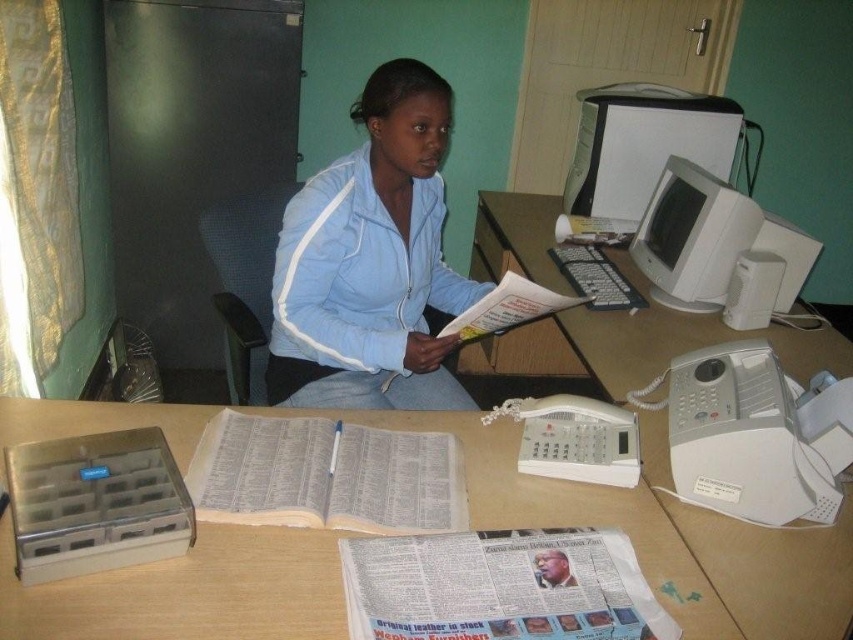
Can you confirm if white paper newspaper at center is positioned above matte gray monitor at upper right?

No, white paper newspaper at center is not above matte gray monitor at upper right.

Image resolution: width=853 pixels, height=640 pixels. Describe the element at coordinates (500, 586) in the screenshot. I see `white paper newspaper at center` at that location.

Which is in front, point (440, 556) or point (706, 216)?

Point (440, 556) is in front.

You are a GUI agent. You are given a task and a screenshot of the screen. Output one action in this format:
    pyautogui.click(x=<x>, y=<y>)
    Task: Click on the white paper newspaper at center
    
    Given the screenshot: What is the action you would take?
    pyautogui.click(x=500, y=586)

Does point (251, 538) come behind point (413, 516)?

No.

Does wooden table at center have a lesser height compared to white paper book at center?

No.

Identify the location of wooden table at center. The width and height of the screenshot is (853, 640). (190, 592).

This screenshot has height=640, width=853. I want to click on wooden table at center, so click(190, 592).

Can you confirm if wooden table at center is positioned to the left of white paper at center?

Indeed, wooden table at center is positioned on the left side of white paper at center.

Locate an element on the screen. wooden table at center is located at coordinates (190, 592).

Locate an element on the screen. Image resolution: width=853 pixels, height=640 pixels. wooden table at center is located at coordinates (190, 592).

Identify the location of wooden table at center. (190, 592).